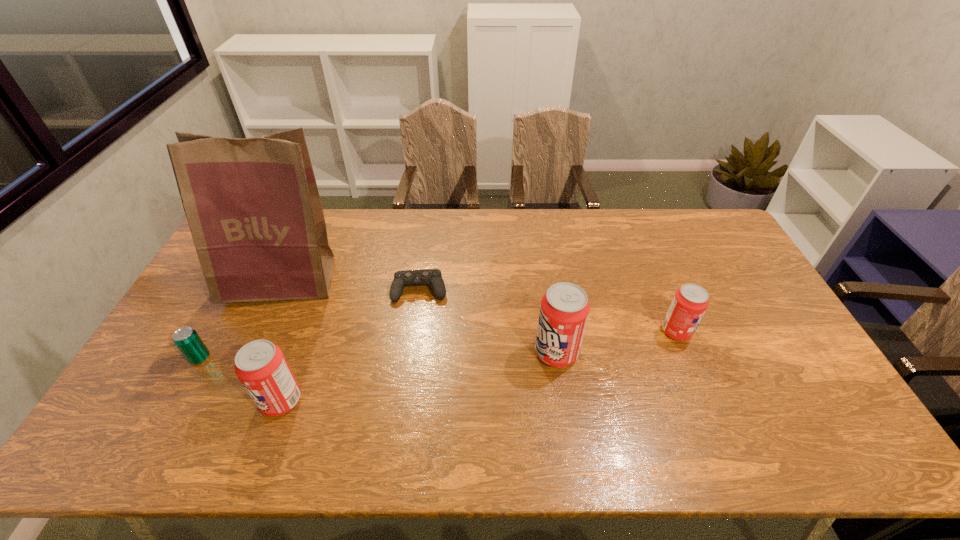
The width and height of the screenshot is (960, 540). I want to click on vacant space in between the tallest object and the second tallest soda can, so click(281, 341).

This screenshot has width=960, height=540. I want to click on free space between the nearest object and the control, so click(350, 346).

At what (x,y) coordinates should I click in order to perform the action: click on unoccupied position between the second object from right to left and the fourth shortest object. Please return your answer as a coordinate pair (x, y). The width and height of the screenshot is (960, 540). Looking at the image, I should click on (419, 376).

This screenshot has width=960, height=540. Find the location of `vacant space that is in between the grocery bag and the shortest object`. vacant space that is in between the grocery bag and the shortest object is located at coordinates (350, 286).

The width and height of the screenshot is (960, 540). In order to click on free space between the second object from right to left and the shortest object in this screenshot , I will do `click(488, 321)`.

Locate an element on the screen. The height and width of the screenshot is (540, 960). free space that is in between the grocery bag and the control is located at coordinates (350, 286).

Identify which object is the fourth nearest to the rightmost object. Please provide its 2D coordinates. Your answer should be formatted as a tuple, i.e. [(x, y)], where the tuple contains the x and y coordinates of a point satisfying the conditions above.

[(253, 208)]

I want to click on object that stands as the fifth closest to the fourth shortest object, so click(690, 302).

Identify the location of soda can that stands as the third closest to the tallest object. (690, 302).

Identify which soda can is located as the nearest to the second soda can from left to right. Please provide its 2D coordinates. Your answer should be formatted as a tuple, i.e. [(x, y)], where the tuple contains the x and y coordinates of a point satisfying the conditions above.

[(690, 302)]